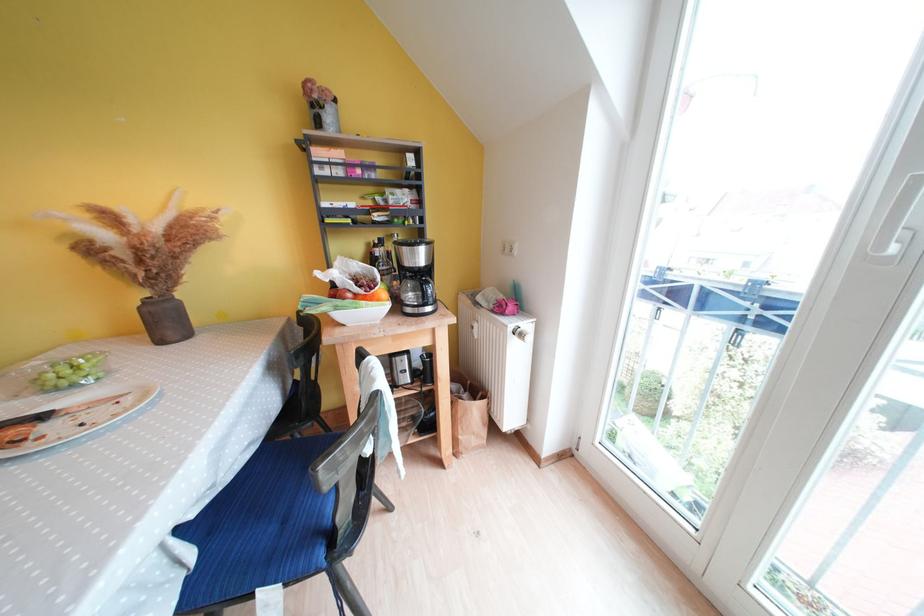
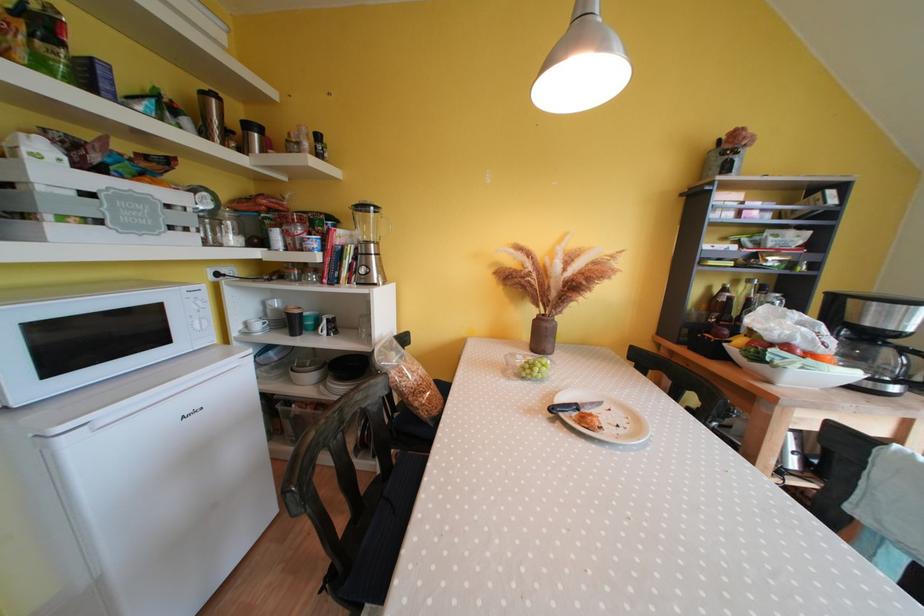
The point at (49, 419) is marked in the first image. Where is the corresponding point in the second image?

(582, 410)